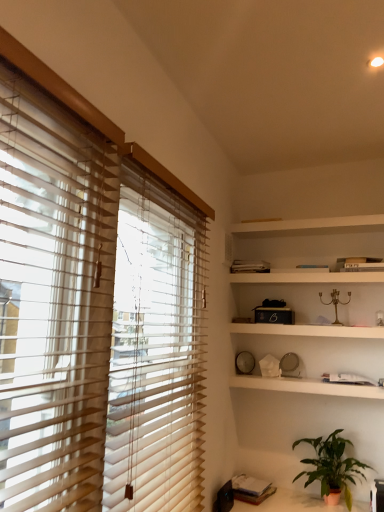
The width and height of the screenshot is (384, 512). Identify the location of white matte shelf at center, the third shelf when ordered from top to bottom. (308, 330).

The image size is (384, 512). What do you see at coordinates (289, 503) in the screenshot?
I see `matte black table at lower right` at bounding box center [289, 503].

At what (x,y) coordinates should I click in order to perform the action: click on white wooden shelf at upper center, positioned as the 1th shelf in top-to-bottom order. Please return your answer as a coordinate pair (x, y). Image resolution: width=384 pixels, height=512 pixels. Looking at the image, I should click on (307, 224).

This screenshot has height=512, width=384. Describe the element at coordinates (332, 465) in the screenshot. I see `green matte plant at lower right` at that location.

This screenshot has width=384, height=512. Identify the location of beige wood blinds at left. (53, 300).

How far apart are beige wood blinds at left and white matte bookshelf at upper center, acting as the 3th shelf starting from the bottom?

The distance of beige wood blinds at left from white matte bookshelf at upper center, acting as the 3th shelf starting from the bottom, is 1.92 meters.

Which is behind, beige wood blinds at left or white matte bookshelf at upper center, which is counted as the 2th shelf, starting from the top?

white matte bookshelf at upper center, which is counted as the 2th shelf, starting from the top.

Which is more to the left, beige wood blinds at left or white matte bookshelf at upper center, acting as the 3th shelf starting from the bottom?

beige wood blinds at left.

Based on the photo, which of these two, matte black book at lower right, which is the 1th book from front to back, or white matte shelf at center, the third shelf when ordered from top to bottom, is smaller?

Smaller between the two is matte black book at lower right, which is the 1th book from front to back.

Is matte black book at lower right, which is the first book in bottom-to-top order, looking in the opposite direction of white matte shelf at center, the 2th shelf positioned from the bottom?

No, matte black book at lower right, which is the first book in bottom-to-top order, is not facing away from white matte shelf at center, the 2th shelf positioned from the bottom.

How many degrees apart are the facing directions of matte black book at lower right, positioned as the second book in back-to-front order, and white matte shelf at center, the third shelf when ordered from top to bottom?

There is a 10.8-degree angle between the facing directions of matte black book at lower right, positioned as the second book in back-to-front order, and white matte shelf at center, the third shelf when ordered from top to bottom.

Does point (270, 492) lie in front of point (321, 334)?

That is True.

Considering the relative sizes of matte black table at lower right and green matte plant at lower right in the image provided, is matte black table at lower right thinner than green matte plant at lower right?

No, matte black table at lower right is not thinner than green matte plant at lower right.

How many degrees apart are the facing directions of matte black table at lower right and green matte plant at lower right?

The angle between the facing direction of matte black table at lower right and the facing direction of green matte plant at lower right is 0.602 degrees.

Looking at this image, does matte black table at lower right appear on the right side of green matte plant at lower right?

Incorrect, matte black table at lower right is not on the right side of green matte plant at lower right.

Would you say matte black table at lower right is a long distance from green matte plant at lower right?

matte black table at lower right is actually quite close to green matte plant at lower right.

From the image's perspective, is white wooden shelf at upper center, marked as the fourth shelf in a bottom-to-top arrangement, positioned above or below white matte clock at center, which is the 1th shelf from bottom to top?

white wooden shelf at upper center, marked as the fourth shelf in a bottom-to-top arrangement, is situated higher than white matte clock at center, which is the 1th shelf from bottom to top, in the image.

Considering the sizes of objects white wooden shelf at upper center, marked as the fourth shelf in a bottom-to-top arrangement, and white matte clock at center, the 4th shelf viewed from the top, in the image provided, who is bigger, white wooden shelf at upper center, marked as the fourth shelf in a bottom-to-top arrangement, or white matte clock at center, the 4th shelf viewed from the top,?

white matte clock at center, the 4th shelf viewed from the top, is bigger.

From the image's perspective, which shelf is the 3rd one above the white matte clock at center, which is the 1th shelf from bottom to top? Please provide its 2D coordinates.

[(307, 224)]

Is white matte clock at center, which is the 1th shelf from bottom to top, inside white wooden shelf at upper center, marked as the fourth shelf in a bottom-to-top arrangement?

Actually, white matte clock at center, which is the 1th shelf from bottom to top, is outside white wooden shelf at upper center, marked as the fourth shelf in a bottom-to-top arrangement.

From a real-world perspective, is white matte bookshelf at upper center, acting as the 3th shelf starting from the bottom, physically above beige wood blinds at left?

Yes, from a real-world perspective, white matte bookshelf at upper center, acting as the 3th shelf starting from the bottom, is over beige wood blinds at left

Is white matte bookshelf at upper center, which is counted as the 2th shelf, starting from the top, outside of beige wood blinds at left?

Yes, white matte bookshelf at upper center, which is counted as the 2th shelf, starting from the top, is located beyond the bounds of beige wood blinds at left.

Who is smaller, white matte bookshelf at upper center, acting as the 3th shelf starting from the bottom, or beige wood blinds at left?

Smaller between the two is white matte bookshelf at upper center, acting as the 3th shelf starting from the bottom.

Is matte black book at lower right, which is the first book in bottom-to-top order, positioned with its back to white matte book at upper center, acting as the 1th book starting from the top?

No, matte black book at lower right, which is the first book in bottom-to-top order,'s orientation is not away from white matte book at upper center, acting as the 1th book starting from the top.

Could you measure the distance between matte black book at lower right, which is the 1th book from front to back, and white matte book at upper center, acting as the 1th book starting from the top?

matte black book at lower right, which is the 1th book from front to back, and white matte book at upper center, acting as the 1th book starting from the top, are 4.82 feet apart from each other.

Considering the relative positions of matte black book at lower right, which is the first book in bottom-to-top order, and white matte book at upper center, the second book positioned from the front, in the image provided, is matte black book at lower right, which is the first book in bottom-to-top order, to the left or to the right of white matte book at upper center, the second book positioned from the front,?

In the image, matte black book at lower right, which is the first book in bottom-to-top order, appears on the left side of white matte book at upper center, the second book positioned from the front.

Is matte black book at lower right, which ranks as the second book in top-to-bottom order, taller than white matte book at upper center, the 2th book from the bottom?

Incorrect, the height of matte black book at lower right, which ranks as the second book in top-to-bottom order, is not larger of that of white matte book at upper center, the 2th book from the bottom.

From a real-world perspective, count 1st books downward from the white wooden shelf at upper center, positioned as the 1th shelf in top-to-bottom order, and point to it. Please provide its 2D coordinates.

[(250, 266)]

From a real-world perspective, between white matte book at upper center, the second book positioned from the front, and white wooden shelf at upper center, positioned as the 1th shelf in top-to-bottom order, who is vertically lower?

white matte book at upper center, the second book positioned from the front, is physically lower.

Considering the positions of objects white matte book at upper center, acting as the 1th book starting from the top, and white wooden shelf at upper center, positioned as the 1th shelf in top-to-bottom order, in the image provided, who is more to the right, white matte book at upper center, acting as the 1th book starting from the top, or white wooden shelf at upper center, positioned as the 1th shelf in top-to-bottom order,?

From the viewer's perspective, white wooden shelf at upper center, positioned as the 1th shelf in top-to-bottom order, appears more on the right side.

Is point (243, 272) positioned behind point (364, 226)?

No, it is in front of (364, 226).

Identify the location of shelf that is the 3rd object to the right of the beige wood blinds at left, starting at the anchor. (307, 277).

Find the location of a particular element. The height and width of the screenshot is (512, 384). the 1st book behind the white matte shelf at center, the third shelf when ordered from top to bottom, starting your count from the anchor is located at coordinates (251, 489).

Considering their positions, is matte black table at lower right positioned closer to white matte clock at center, which is the 1th shelf from bottom to top, than white matte book at upper center, acting as the 1th book starting from the top?

Based on the image, matte black table at lower right appears to be nearer to white matte clock at center, which is the 1th shelf from bottom to top.

Estimate the real-world distances between objects in this image. Which object is closer to white matte clock at center, the 4th shelf viewed from the top, matte black book at lower right, which ranks as the second book in top-to-bottom order, or green matte plant at lower right?

green matte plant at lower right lies closer to white matte clock at center, the 4th shelf viewed from the top, than the other object.

Considering their positions, is white matte bookshelf at upper center, which is counted as the 2th shelf, starting from the top, positioned further to white matte shelf at center, the 2th shelf positioned from the bottom, than white wooden shelf at upper center, marked as the fourth shelf in a bottom-to-top arrangement?

white wooden shelf at upper center, marked as the fourth shelf in a bottom-to-top arrangement.

From the picture: Looking at the image, which one is located further to matte black table at lower right, white matte shelf at center, the third shelf when ordered from top to bottom, or matte black book at lower right, which is the 1th book from front to back?

white matte shelf at center, the third shelf when ordered from top to bottom, lies further to matte black table at lower right than the other object.

When comparing their distances from green matte plant at lower right, does white matte book at upper center, acting as the 1th book starting from the top, or matte black book at lower right, which is the first book in bottom-to-top order, seem further?

white matte book at upper center, acting as the 1th book starting from the top, lies further to green matte plant at lower right than the other object.

Estimate the real-world distances between objects in this image. Which object is further from matte black table at lower right, white wooden shelf at upper center, marked as the fourth shelf in a bottom-to-top arrangement, or matte black book at lower right, which is the first book in bottom-to-top order?

The object further to matte black table at lower right is white wooden shelf at upper center, marked as the fourth shelf in a bottom-to-top arrangement.

Looking at this image, considering their positions, is white matte clock at center, which is the 1th shelf from bottom to top, positioned closer to green matte plant at lower right than white wooden shelf at upper center, positioned as the 1th shelf in top-to-bottom order?

white matte clock at center, which is the 1th shelf from bottom to top.

Based on their spatial positions, is matte black table at lower right or white matte bookshelf at upper center, acting as the 3th shelf starting from the bottom, closer to white wooden shelf at upper center, marked as the fourth shelf in a bottom-to-top arrangement?

white matte bookshelf at upper center, acting as the 3th shelf starting from the bottom, is closer to white wooden shelf at upper center, marked as the fourth shelf in a bottom-to-top arrangement.

I want to click on houseplant between beige wood blinds at left and white wooden shelf at upper center, marked as the fourth shelf in a bottom-to-top arrangement, along the z-axis, so click(332, 465).

Image resolution: width=384 pixels, height=512 pixels. I want to click on book between white wooden shelf at upper center, positioned as the 1th shelf in top-to-bottom order, and green matte plant at lower right in the up-down direction, so click(x=250, y=266).

The image size is (384, 512). In order to click on houseplant that lies between white matte clock at center, which is the 1th shelf from bottom to top, and matte black book at lower right, positioned as the second book in back-to-front order, from top to bottom in this screenshot , I will do `click(332, 465)`.

Find the location of a particular element. This screenshot has width=384, height=512. table located between beige wood blinds at left and white matte book at upper center, the 2th book from the bottom, in the depth direction is located at coordinates (x=289, y=503).